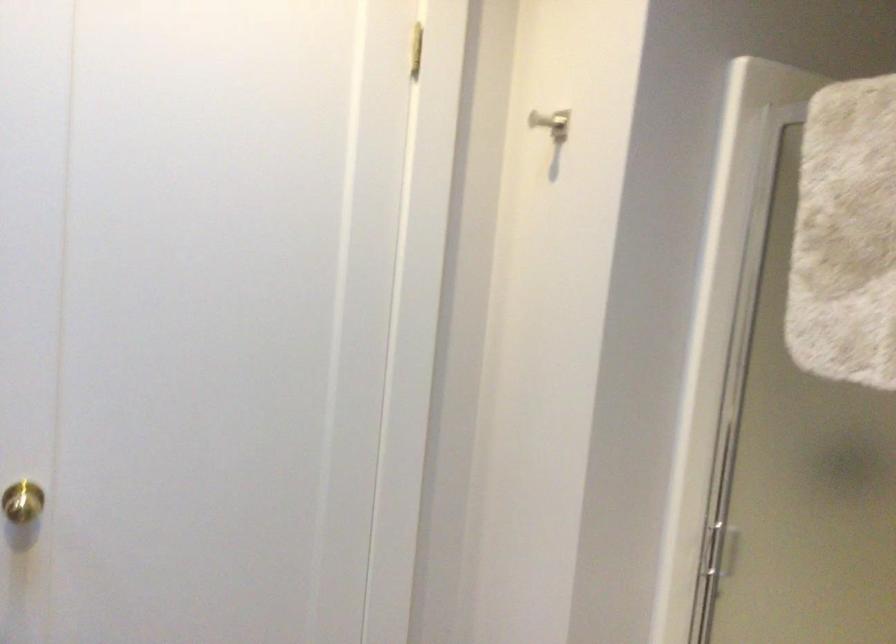
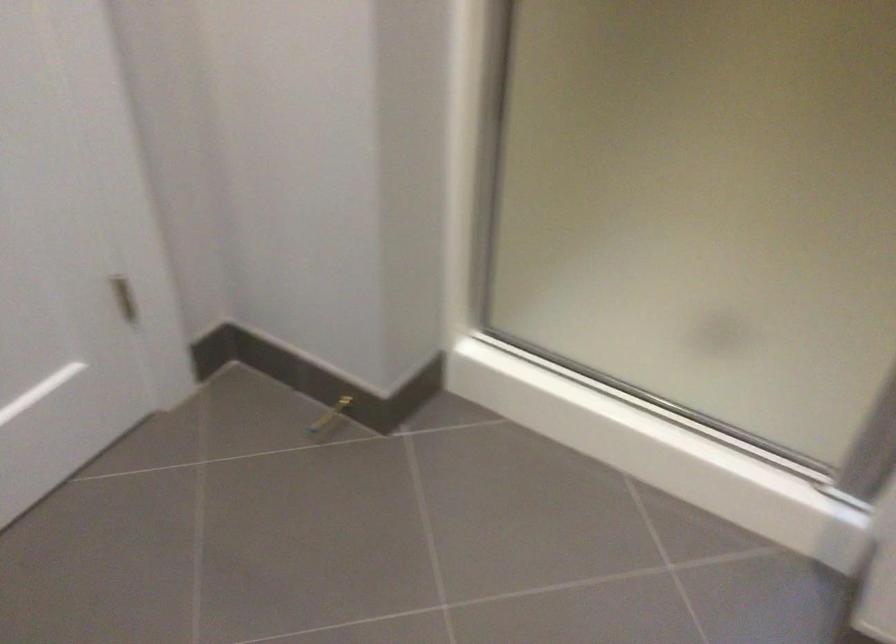
The first image is from the beginning of the video and the second image is from the end. How did the camera likely rotate when shooting the video?

The camera rotated toward right-down.